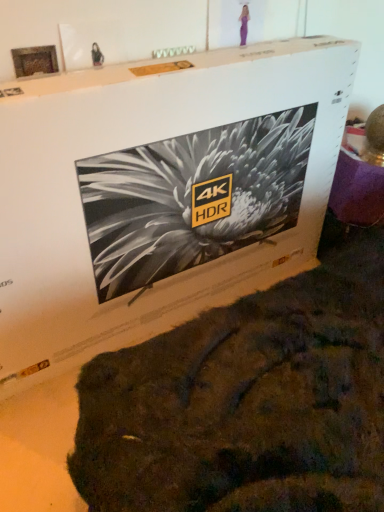
Find the location of a particular element. free point above white cardboard box at upper center (from a real-world perspective) is located at coordinates (173, 62).